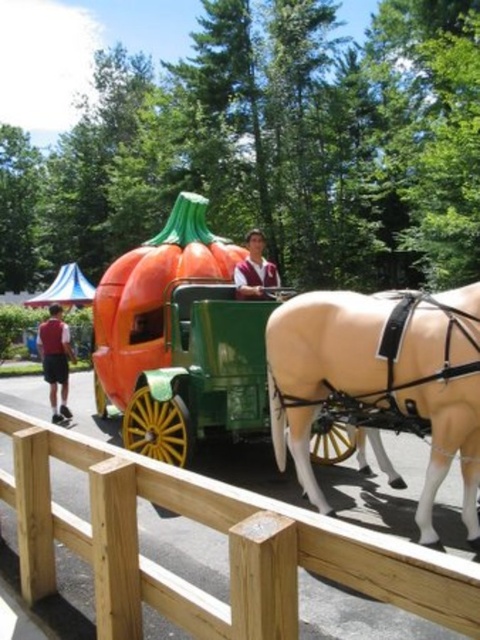
You are a photographer standing in front of the tan matte horse at center and the matte red shorts at lower left. You want to take a photo that includes both subjects. Which subject should you focus on first to ensure both are in frame?

You should focus on the tan matte horse at center first since it is closer to you than the matte red shorts at lower left, allowing you to adjust the frame to include both subjects.

You are a painter standing near the tan matte horse at center and the matte red shorts at lower left. You want to paint both objects but only have enough paint for the wider object. Which object should you choose?

The tan matte horse at center is wider than the matte red shorts at lower left, so you should choose to paint the tan matte horse at center.

You are standing in front of the horse and want to take a photo of the point at coordinates point (453,344). If your camera has a focal length of 50mm and you are 3.55 meters away from the point, what is the angle of view required to capture the entire scene including the horse and the pumpkin carriage?

The point (453,344) is 3.55 meters away from the camera. To calculate the angle of view, use the formula angle of view in degrees equals 2 times arctangent of half the subject width divided by distance. However, without knowing the subject width, we cannot compute the exact angle. Please provide the width of the subject to proceed.